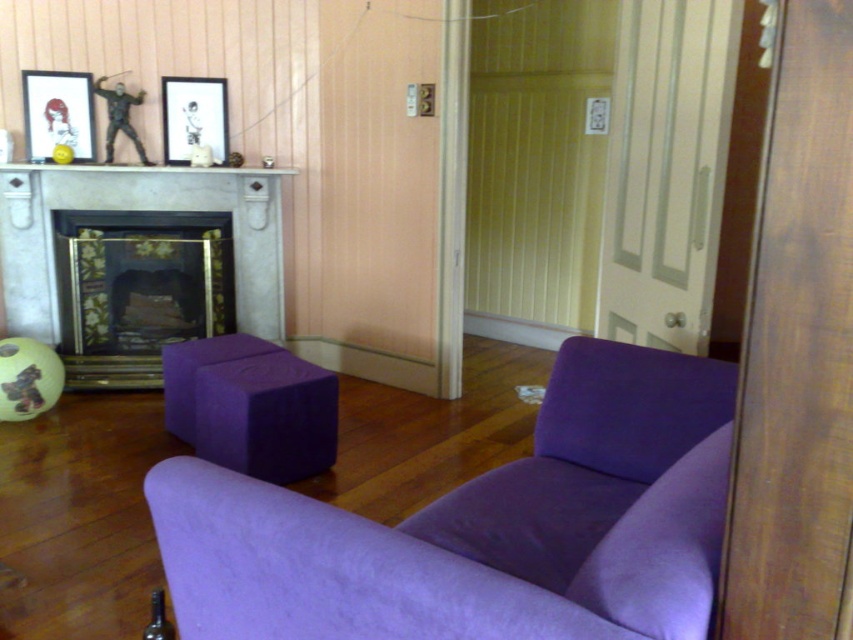
Question: Can you confirm if purple foam block at lower center is positioned to the right of matte black picture frame at upper center?

Choices:
 (A) no
 (B) yes

Answer: (B)

Question: Does matte gray fireplace at left appear over matte black picture frame at upper left?

Choices:
 (A) no
 (B) yes

Answer: (A)

Question: Which object appears farthest from the camera in this image?

Choices:
 (A) matte black picture frame at upper center
 (B) matte black picture frame at upper left
 (C) purple fabric armchair at center
 (D) matte gray fireplace at left

Answer: (A)

Question: Estimate the real-world distances between objects in this image. Which object is farther from the purple foam block at lower center?

Choices:
 (A) matte black picture frame at upper center
 (B) purple fabric armchair at center
 (C) matte black picture frame at upper left
 (D) matte gray fireplace at left

Answer: (C)

Question: Does matte gray fireplace at left have a smaller size compared to matte black picture frame at upper left?

Choices:
 (A) yes
 (B) no

Answer: (B)

Question: Which point is farther to the camera?

Choices:
 (A) (310, 467)
 (B) (540, 506)
 (C) (228, 150)

Answer: (C)